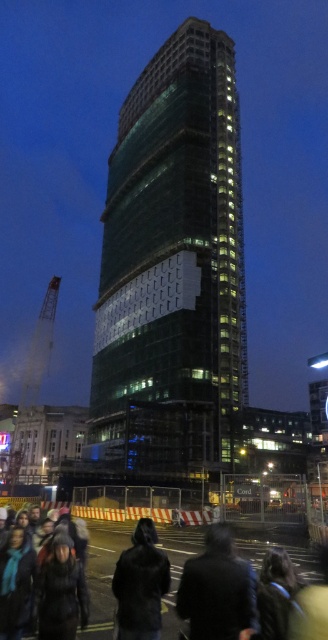
You are standing at the construction site and see the black wool coat at lower center. If you want to place a safety cone 2 meters away from the coat, where should you position it relative to the coat?

The black wool coat at lower center is located at point (217, 589). To place the safety cone 2 meters away, you should position it 2 meters away from the coat in the desired direction, maintaining the same coordinate system.

You are standing at the construction site and want to know the exact coordinates of the green glass tower at center. What are its coordinates?

The green glass tower at center is located at point (175, 253).